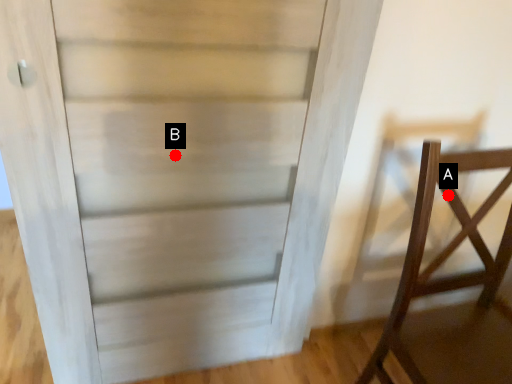
Question: Two points are circled on the image, labeled by A and B beside each circle. Which point is closer to the camera?

Choices:
 (A) A is closer
 (B) B is closer

Answer: (B)